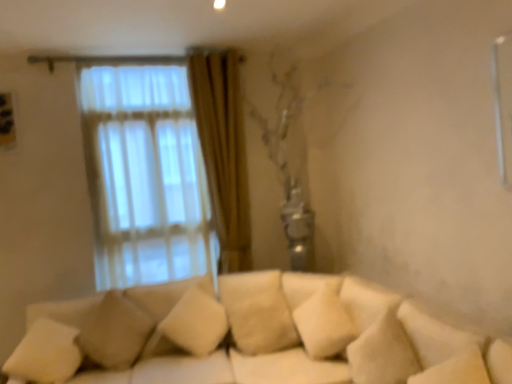
Identify the location of beige fabric pillow at center, the first pillow from the right. This screenshot has width=512, height=384. (257, 311).

What is the approximate height of beige fabric pillow at lower left, the second pillow viewed from the right?

59.57 centimeters.

The width and height of the screenshot is (512, 384). Find the location of `beige fabric pillow at center, the first pillow from the right`. beige fabric pillow at center, the first pillow from the right is located at coordinates (257, 311).

Does beige fabric pillow at center, the third pillow when ordered from left to right, contain beige fabric pillow at lower left, which is the 2th pillow from left to right?

Definitely not — beige fabric pillow at lower left, which is the 2th pillow from left to right, is not inside beige fabric pillow at center, the third pillow when ordered from left to right.

The height and width of the screenshot is (384, 512). I want to click on the 1st pillow counting from the left side of the beige fabric pillow at center, the third pillow when ordered from left to right, so click(x=115, y=332).

Does beige fabric pillow at center, the first pillow from the right, have a larger size compared to beige fabric pillow at lower left, which is the 2th pillow from left to right?

Yes.

Does white soft pillow at lower left, which appears as the 3th pillow when viewed from the right, have a greater height compared to beige fabric pillow at lower left, which is the 2th pillow from left to right?

No, white soft pillow at lower left, which appears as the 3th pillow when viewed from the right, is not taller than beige fabric pillow at lower left, which is the 2th pillow from left to right.

Is white soft pillow at lower left, which is the 1th pillow in left-to-right order, positioned with its back to beige fabric pillow at lower left, the second pillow viewed from the right?

No, white soft pillow at lower left, which is the 1th pillow in left-to-right order, is not facing away from beige fabric pillow at lower left, the second pillow viewed from the right.

Considering the relative positions of white soft pillow at lower left, which appears as the 3th pillow when viewed from the right, and beige fabric pillow at lower left, which is the 2th pillow from left to right, in the image provided, is white soft pillow at lower left, which appears as the 3th pillow when viewed from the right, in front of beige fabric pillow at lower left, which is the 2th pillow from left to right,?

Yes, white soft pillow at lower left, which appears as the 3th pillow when viewed from the right, is closer to the camera.

In the scene shown: How much distance is there between white soft pillow at lower left, which appears as the 3th pillow when viewed from the right, and beige fabric pillow at lower left, the second pillow viewed from the right?

white soft pillow at lower left, which appears as the 3th pillow when viewed from the right, and beige fabric pillow at lower left, the second pillow viewed from the right, are 8.76 inches apart.

Find the location of `the 2nd pillow to the right when counting from the white soft pillow at lower left, which appears as the 3th pillow when viewed from the right`. the 2nd pillow to the right when counting from the white soft pillow at lower left, which appears as the 3th pillow when viewed from the right is located at coordinates (257, 311).

Is beige fabric pillow at center, the third pillow when ordered from left to right, far from white soft pillow at lower left, which appears as the 3th pillow when viewed from the right?

That's right, there is a large distance between beige fabric pillow at center, the third pillow when ordered from left to right, and white soft pillow at lower left, which appears as the 3th pillow when viewed from the right.

Which object is closer to the camera taking this photo, beige fabric pillow at center, the third pillow when ordered from left to right, or white soft pillow at lower left, which is the 1th pillow in left-to-right order?

Positioned in front is white soft pillow at lower left, which is the 1th pillow in left-to-right order.

How many degrees apart are the facing directions of beige fabric pillow at center, the first pillow from the right, and white soft pillow at lower left, which appears as the 3th pillow when viewed from the right?

beige fabric pillow at center, the first pillow from the right, and white soft pillow at lower left, which appears as the 3th pillow when viewed from the right, are facing 41.2 degrees away from each other.

Is beige fabric pillow at lower left, the second pillow viewed from the right, beside beige fabric pillow at center, the third pillow when ordered from left to right?

No, beige fabric pillow at lower left, the second pillow viewed from the right, is not next to beige fabric pillow at center, the third pillow when ordered from left to right.

Between point (127, 357) and point (258, 342), which one is positioned behind?

The point (127, 357) is farther.

Which is correct: beige fabric pillow at lower left, which is the 2th pillow from left to right, is inside beige fabric pillow at center, the third pillow when ordered from left to right, or outside of it?

beige fabric pillow at lower left, which is the 2th pillow from left to right, lies outside beige fabric pillow at center, the third pillow when ordered from left to right.

Who is taller, beige fabric pillow at lower left, the second pillow viewed from the right, or beige fabric pillow at center, the third pillow when ordered from left to right?

With more height is beige fabric pillow at lower left, the second pillow viewed from the right.

Is beige fabric pillow at lower left, which is the 2th pillow from left to right, at the right side of white soft pillow at lower left, which is the 1th pillow in left-to-right order?

Indeed, beige fabric pillow at lower left, which is the 2th pillow from left to right, is positioned on the right side of white soft pillow at lower left, which is the 1th pillow in left-to-right order.

Is beige fabric pillow at lower left, which is the 2th pillow from left to right, oriented towards white soft pillow at lower left, which is the 1th pillow in left-to-right order?

No, beige fabric pillow at lower left, which is the 2th pillow from left to right, is not aimed at white soft pillow at lower left, which is the 1th pillow in left-to-right order.

In terms of height, does beige fabric pillow at lower left, which is the 2th pillow from left to right, look taller or shorter compared to white soft pillow at lower left, which appears as the 3th pillow when viewed from the right?

beige fabric pillow at lower left, which is the 2th pillow from left to right, is taller than white soft pillow at lower left, which appears as the 3th pillow when viewed from the right.

How many degrees apart are the facing directions of beige fabric pillow at lower left, the second pillow viewed from the right, and white soft pillow at lower left, which appears as the 3th pillow when viewed from the right?

There is a 10.7-degree angle between the facing directions of beige fabric pillow at lower left, the second pillow viewed from the right, and white soft pillow at lower left, which appears as the 3th pillow when viewed from the right.

Can you confirm if white soft pillow at lower left, which is the 1th pillow in left-to-right order, is wider than beige fabric pillow at center, the third pillow when ordered from left to right?

No, white soft pillow at lower left, which is the 1th pillow in left-to-right order, is not wider than beige fabric pillow at center, the third pillow when ordered from left to right.

Can you tell me how much white soft pillow at lower left, which appears as the 3th pillow when viewed from the right, and beige fabric pillow at center, the third pillow when ordered from left to right, differ in facing direction?

The angle between the facing direction of white soft pillow at lower left, which appears as the 3th pillow when viewed from the right, and the facing direction of beige fabric pillow at center, the third pillow when ordered from left to right, is 41.2 degrees.

From a real-world perspective, relative to beige fabric pillow at center, the third pillow when ordered from left to right, is white soft pillow at lower left, which is the 1th pillow in left-to-right order, vertically above or below?

Clearly, from a real-world perspective, white soft pillow at lower left, which is the 1th pillow in left-to-right order, is above beige fabric pillow at center, the third pillow when ordered from left to right.

From the image's perspective, between white soft pillow at lower left, which is the 1th pillow in left-to-right order, and beige fabric pillow at center, the third pillow when ordered from left to right, which one is located above?

beige fabric pillow at center, the third pillow when ordered from left to right, from the image's perspective.

The width and height of the screenshot is (512, 384). Identify the location of pillow to the right of beige fabric pillow at lower left, which is the 2th pillow from left to right. (257, 311).

You are a GUI agent. You are given a task and a screenshot of the screen. Output one action in this format:
    pyautogui.click(x=<x>, y=<y>)
    Task: Click on the pillow below the beige fabric pillow at lower left, the second pillow viewed from the right (from the image's perspective)
    Image resolution: width=512 pixels, height=384 pixels.
    Given the screenshot: What is the action you would take?
    pyautogui.click(x=45, y=353)

Based on their spatial positions, is beige fabric pillow at center, the first pillow from the right, or beige fabric pillow at lower left, the second pillow viewed from the right, closer to white soft pillow at lower left, which appears as the 3th pillow when viewed from the right?

beige fabric pillow at lower left, the second pillow viewed from the right.

When comparing their distances from beige fabric pillow at center, the first pillow from the right, does beige fabric pillow at lower left, the second pillow viewed from the right, or white soft pillow at lower left, which is the 1th pillow in left-to-right order, seem further?

white soft pillow at lower left, which is the 1th pillow in left-to-right order, is positioned further to the anchor beige fabric pillow at center, the first pillow from the right.

Estimate the real-world distances between objects in this image. Which object is closer to white soft pillow at lower left, which is the 1th pillow in left-to-right order, beige fabric pillow at lower left, which is the 2th pillow from left to right, or beige fabric pillow at center, the first pillow from the right?

Based on the image, beige fabric pillow at lower left, which is the 2th pillow from left to right, appears to be nearer to white soft pillow at lower left, which is the 1th pillow in left-to-right order.

Considering their positions, is white soft pillow at lower left, which appears as the 3th pillow when viewed from the right, positioned closer to beige fabric pillow at center, the first pillow from the right, than beige fabric pillow at lower left, the second pillow viewed from the right?

The object closer to beige fabric pillow at center, the first pillow from the right, is beige fabric pillow at lower left, the second pillow viewed from the right.

When comparing their distances from beige fabric pillow at lower left, the second pillow viewed from the right, does beige fabric pillow at center, the first pillow from the right, or white soft pillow at lower left, which appears as the 3th pillow when viewed from the right, seem further?

beige fabric pillow at center, the first pillow from the right, is positioned further to the anchor beige fabric pillow at lower left, the second pillow viewed from the right.

In the scene shown: Looking at the image, which one is located closer to beige fabric pillow at lower left, the second pillow viewed from the right, white soft pillow at lower left, which is the 1th pillow in left-to-right order, or beige fabric pillow at center, the third pillow when ordered from left to right?

white soft pillow at lower left, which is the 1th pillow in left-to-right order, is positioned closer to the anchor beige fabric pillow at lower left, the second pillow viewed from the right.

The image size is (512, 384). Identify the location of pillow situated between white soft pillow at lower left, which appears as the 3th pillow when viewed from the right, and beige fabric pillow at center, the third pillow when ordered from left to right, from left to right. (115, 332).